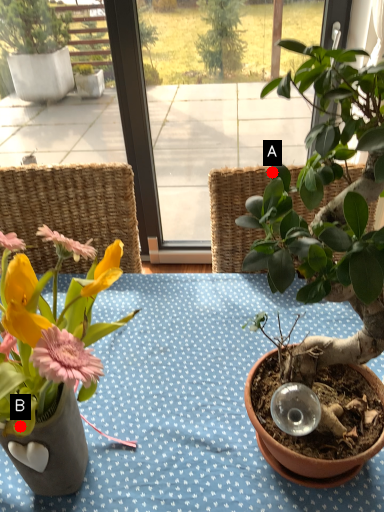
Question: Two points are circled on the image, labeled by A and B beside each circle. Which point is closer to the camera taking this photo?

Choices:
 (A) A is closer
 (B) B is closer

Answer: (B)